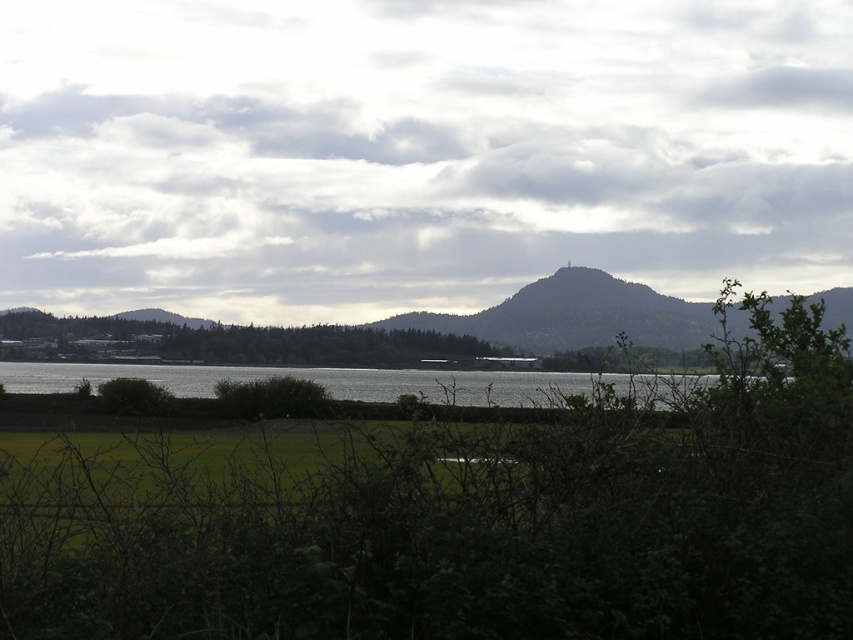
Question: Can you confirm if cloudy sky at upper center is positioned to the left of green leafy mountain at center?

Choices:
 (A) no
 (B) yes

Answer: (B)

Question: Which of the following is the closest to the observer?

Choices:
 (A) silvery reflective water at center
 (B) cloudy sky at upper center
 (C) green leafy mountain at center

Answer: (A)

Question: Can you confirm if cloudy sky at upper center is bigger than silvery reflective water at center?

Choices:
 (A) yes
 (B) no

Answer: (A)

Question: Among these points, which one is nearest to the camera?

Choices:
 (A) (641, 289)
 (B) (827, 129)
 (C) (328, 390)

Answer: (C)

Question: Which is nearer to the green leafy mountain at center?

Choices:
 (A) silvery reflective water at center
 (B) cloudy sky at upper center

Answer: (A)

Question: Is green leafy mountain at center positioned before silvery reflective water at center?

Choices:
 (A) no
 (B) yes

Answer: (A)